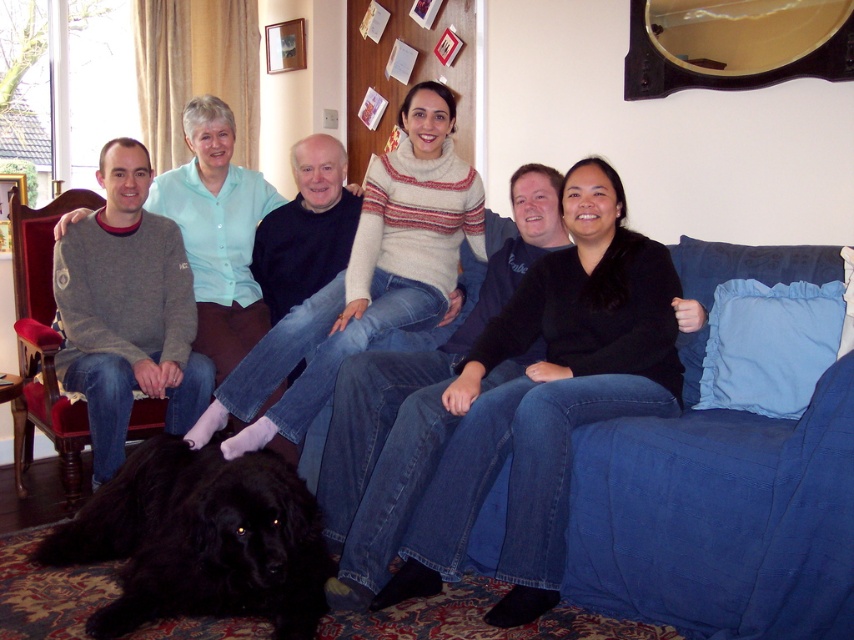
Question: Which of the following is the farthest from the observer?

Choices:
 (A) (468, 180)
 (B) (291, 310)
 (C) (212, 560)
 (D) (39, 252)

Answer: (D)

Question: Which point is farther from the camera taking this photo?

Choices:
 (A) (31, 362)
 (B) (197, 492)

Answer: (A)

Question: Does black fluffy dog at lower left have a lesser width compared to light blue sweater at center?

Choices:
 (A) no
 (B) yes

Answer: (B)

Question: Is matte black dog at lower left thinner than wooden armchair at left?

Choices:
 (A) yes
 (B) no

Answer: (B)

Question: Where is matte black dog at lower left located in relation to black fluffy dog at lower left in the image?

Choices:
 (A) below
 (B) above

Answer: (B)

Question: Which point is farther from the camera taking this photo?

Choices:
 (A) (16, 330)
 (B) (449, 198)
 (C) (454, 348)

Answer: (A)